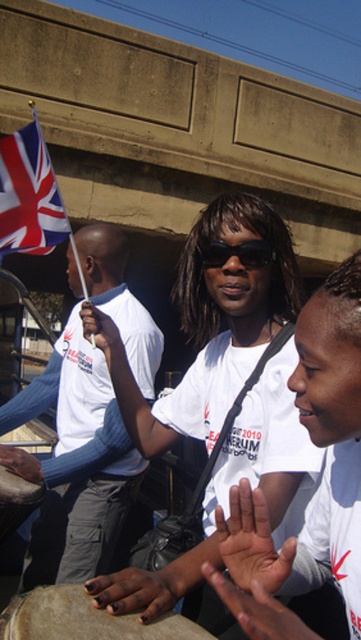
Question: Is smooth skin hand at center bigger than brushed metal drum at lower left?

Choices:
 (A) no
 (B) yes

Answer: (A)

Question: Among these points, which one is nearest to the camera?

Choices:
 (A) (3, 525)
 (B) (48, 536)

Answer: (A)

Question: Among these points, which one is farthest from the camera?

Choices:
 (A) (36, 500)
 (B) (35, 464)

Answer: (B)

Question: Is smooth skin hand at center below brown leather drum at lower left?

Choices:
 (A) yes
 (B) no

Answer: (B)

Question: Observing the image, what is the correct spatial positioning of white matte t-shirt at center in reference to brown leather drum at lower left?

Choices:
 (A) below
 (B) above

Answer: (B)

Question: Which point is closer to the camera?

Choices:
 (A) (16, 456)
 (B) (198, 387)
 (C) (206, 262)
 (D) (267, 509)

Answer: (D)